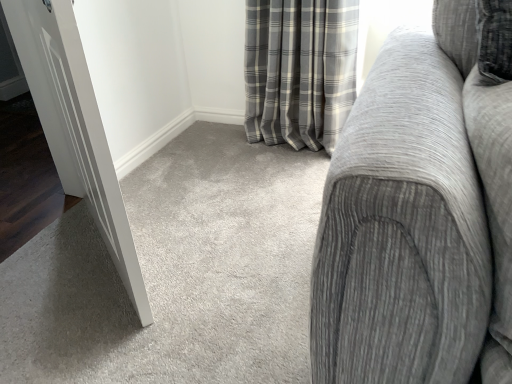
Question: From a real-world perspective, is gray fabric couch at right above or below white glossy door at left?

Choices:
 (A) above
 (B) below

Answer: (A)

Question: Considering the positions of gray fabric couch at right and white glossy door at left in the image, is gray fabric couch at right bigger or smaller than white glossy door at left?

Choices:
 (A) small
 (B) big

Answer: (B)

Question: Looking at their shapes, would you say gray fabric couch at right is wider or thinner than white glossy door at left?

Choices:
 (A) wide
 (B) thin

Answer: (A)

Question: Considering their positions, is white glossy door at left located in front of or behind gray fabric couch at right?

Choices:
 (A) front
 (B) behind

Answer: (B)

Question: From a real-world perspective, is white glossy door at left positioned above or below gray fabric couch at right?

Choices:
 (A) above
 (B) below

Answer: (B)

Question: In terms of height, does white glossy door at left look taller or shorter compared to gray fabric couch at right?

Choices:
 (A) short
 (B) tall

Answer: (B)

Question: From the image's perspective, relative to gray fabric couch at right, is white glossy door at left above or below?

Choices:
 (A) above
 (B) below

Answer: (B)